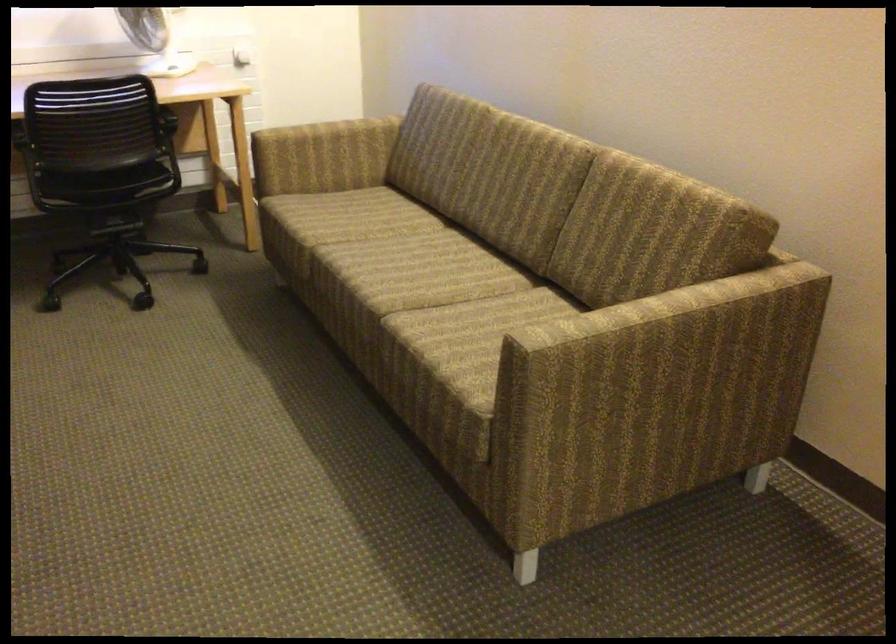
Where would you placing arm the patterned sofa armrest? Please return your answer as a coordinate pair (x, y).

(655, 393)